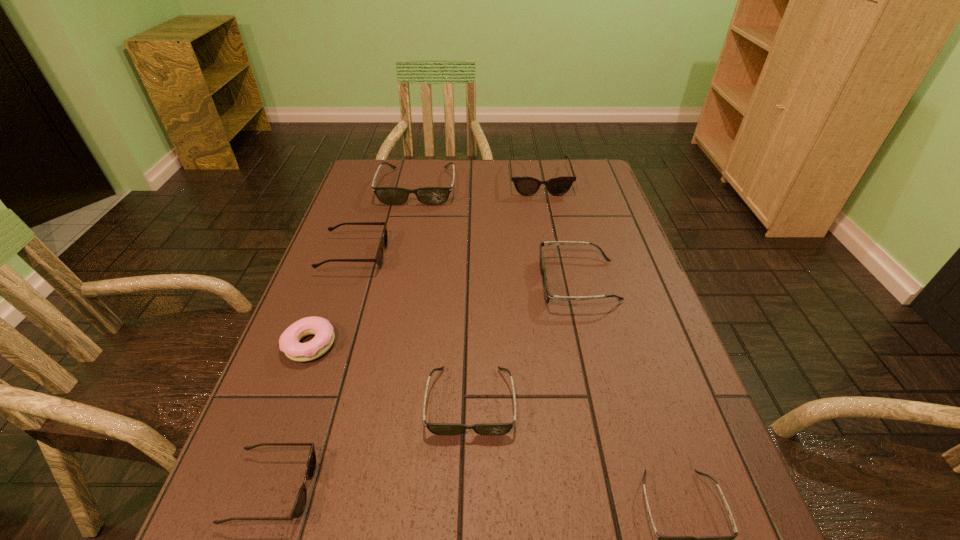
Identify the location of vacant area situated on the front lenses of the biggest brown sunglasses. The width and height of the screenshot is (960, 540). (559, 281).

You are a GUI agent. You are given a task and a screenshot of the screen. Output one action in this format:
    pyautogui.click(x=<x>, y=<y>)
    Task: Click on the free point located on the front-facing side of the biggest black sunglasses
    The height and width of the screenshot is (540, 960).
    Given the screenshot: What is the action you would take?
    pyautogui.click(x=403, y=255)

Where is `vacant space located on the front lenses of the second nearest brown sunglasses`? Image resolution: width=960 pixels, height=540 pixels. vacant space located on the front lenses of the second nearest brown sunglasses is located at coordinates (464, 255).

Where is `free space located on the front-facing side of the second biggest black sunglasses`? The width and height of the screenshot is (960, 540). free space located on the front-facing side of the second biggest black sunglasses is located at coordinates (492, 282).

Locate an element on the screen. The width and height of the screenshot is (960, 540). vacant region located on the front-facing side of the second biggest black sunglasses is located at coordinates (444, 282).

Identify the location of vacant space located on the front-facing side of the second biggest black sunglasses. This screenshot has height=540, width=960. (484, 282).

Locate an element on the screen. vacant space located on the back of the pink doughnut is located at coordinates (346, 248).

The height and width of the screenshot is (540, 960). In order to click on vacant space located on the front-facing side of the second smallest black sunglasses in this screenshot , I will do (x=468, y=529).

This screenshot has height=540, width=960. What are the coordinates of `free spot located 0.070m on the front lenses of the smallest brown sunglasses` in the screenshot? It's located at (353, 489).

This screenshot has width=960, height=540. Identify the location of doughnut that is at the left edge. (289, 343).